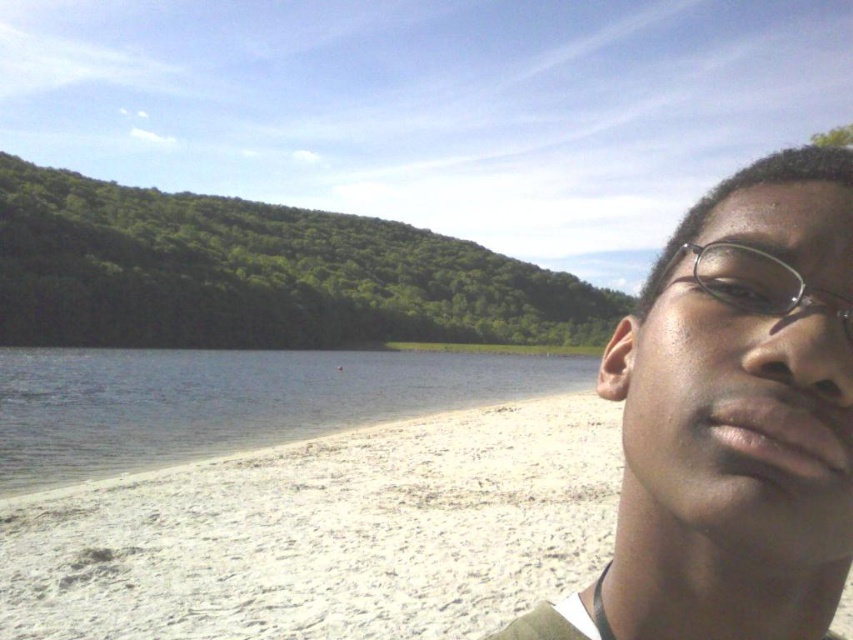
Question: Does matte black glasses at upper right appear over clear water at lower left?

Choices:
 (A) no
 (B) yes

Answer: (B)

Question: Which point is closer to the camera?

Choices:
 (A) (352, 410)
 (B) (767, 289)
 (C) (595, 484)
 (D) (627, 356)

Answer: (B)

Question: Is matte black glasses at upper right to the right of clear plastic glasses at upper right from the viewer's perspective?

Choices:
 (A) yes
 (B) no

Answer: (A)

Question: Considering the real-world distances, which object is farthest from the white sandy beach at lower left?

Choices:
 (A) clear plastic glasses at upper right
 (B) clear water at lower left
 (C) matte black glasses at upper right

Answer: (B)

Question: Does matte black glasses at upper right have a smaller size compared to clear plastic glasses at upper right?

Choices:
 (A) no
 (B) yes

Answer: (A)

Question: Which point is closer to the camera taking this photo?

Choices:
 (A) (256, 593)
 (B) (169, 429)
 (C) (772, 269)
 (D) (645, 634)

Answer: (C)